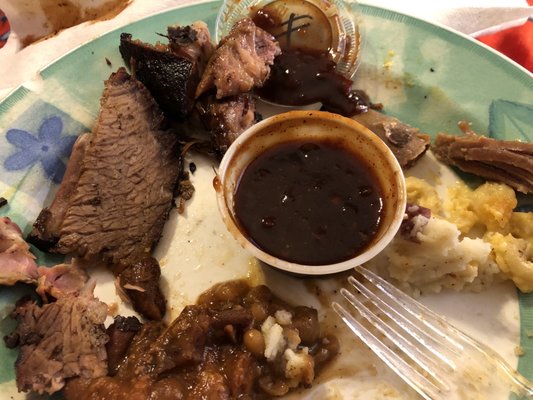
Image resolution: width=533 pixels, height=400 pixels. In order to click on cup in this screenshot , I will do `click(372, 246)`.